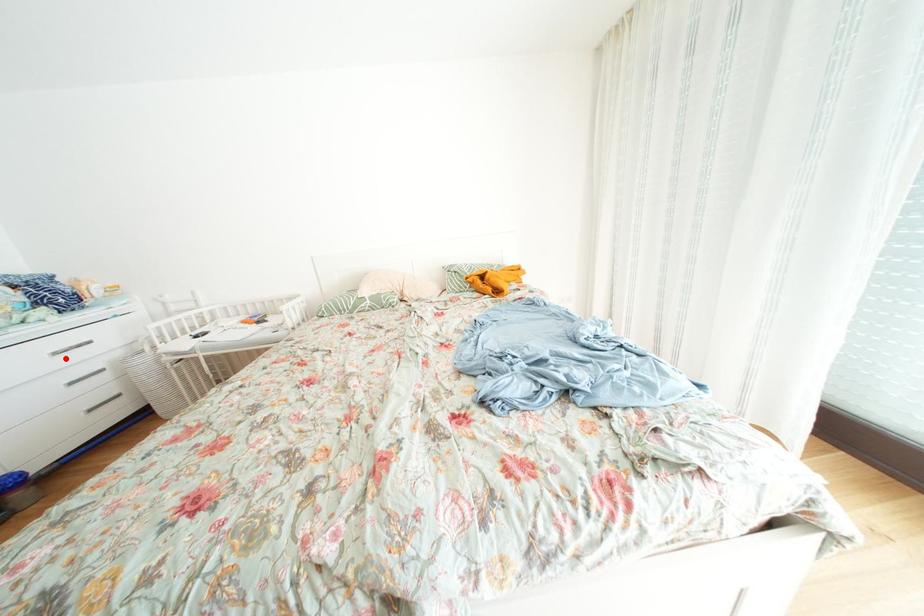
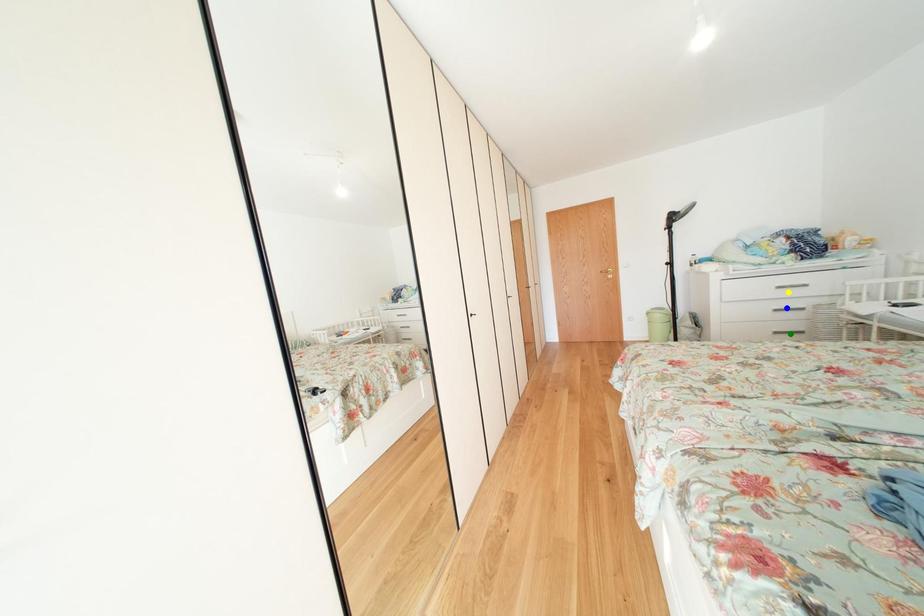
Question: I am providing you with two images of the same scene from different viewpoints. A red point is marked on the first image. You are given multiple points on the second image. Which point in image 2 is actually the same real-world point as the red point in image 1?

Choices:
 (A) blue point
 (B) yellow point
 (C) green point

Answer: (B)